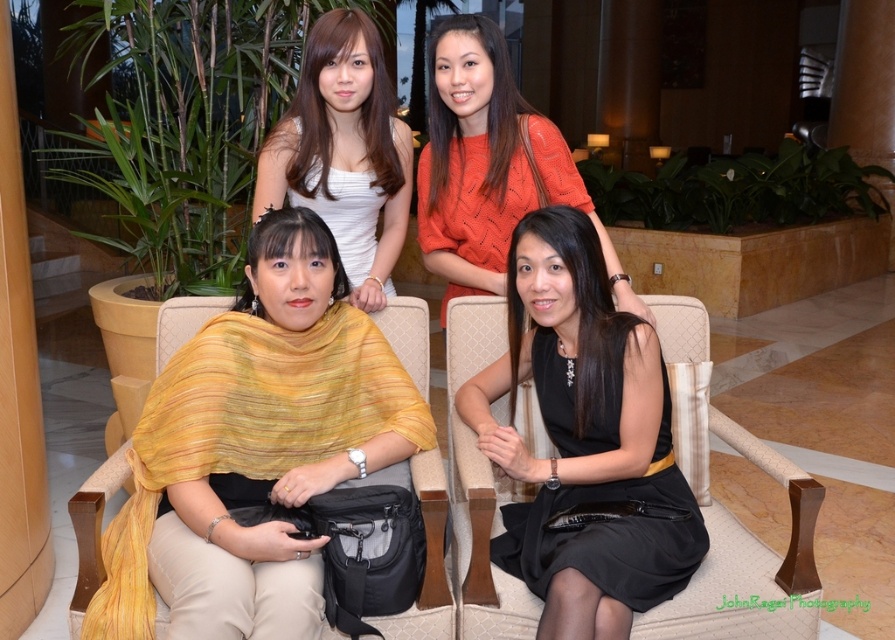
Question: Does yellow textured shawl at center have a lesser width compared to white satin dress at upper center?

Choices:
 (A) yes
 (B) no

Answer: (B)

Question: Is black satin dress at center wider than orange knitwear at upper center?

Choices:
 (A) no
 (B) yes

Answer: (A)

Question: Is the position of yellow textured shawl at center less distant than that of orange knitwear at upper center?

Choices:
 (A) yes
 (B) no

Answer: (A)

Question: Estimate the real-world distances between objects in this image. Which object is closer to the black satin dress at center?

Choices:
 (A) yellow textured shawl at center
 (B) white satin dress at upper center

Answer: (A)

Question: Which object is farther from the camera taking this photo?

Choices:
 (A) white satin dress at upper center
 (B) black satin dress at center

Answer: (A)

Question: Based on their relative distances, which object is farther from the white satin dress at upper center?

Choices:
 (A) orange knitwear at upper center
 (B) black satin dress at center

Answer: (B)